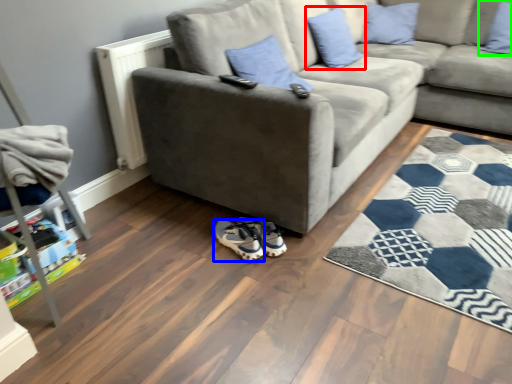
Question: Which object is positioned closest to pillow (highlighted by a red box)? Select from footwear (highlighted by a blue box) and pillow (highlighted by a green box).

Choices:
 (A) footwear
 (B) pillow

Answer: (B)